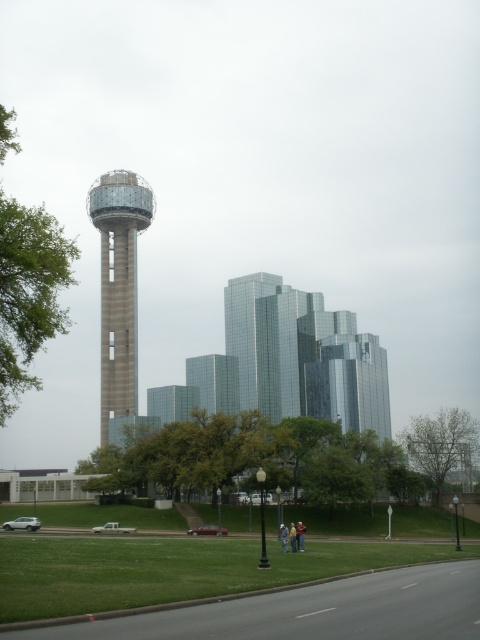
Between point (311, 554) and point (49, 298), which one is positioned in front?

Point (49, 298) is more forward.

Identify the location of green grass at lower center. (175, 566).

Locate an element on the screen. green grass at lower center is located at coordinates (175, 566).

Who is lower down, concrete tower at center or green leafy tree at lower right?

green leafy tree at lower right is below.

Find the location of a particular element. Image resolution: width=480 pixels, height=640 pixels. concrete tower at center is located at coordinates (119, 289).

Where is `concrete tower at center`? This screenshot has height=640, width=480. concrete tower at center is located at coordinates (119, 289).

Does green leafy tree at left appear under concrete tower at center?

Incorrect, green leafy tree at left is not positioned below concrete tower at center.

You are a GUI agent. You are given a task and a screenshot of the screen. Output one action in this format:
    pyautogui.click(x=<x>, y=<y>)
    Task: Click on the green leafy tree at left
    
    Given the screenshot: What is the action you would take?
    pyautogui.click(x=28, y=292)